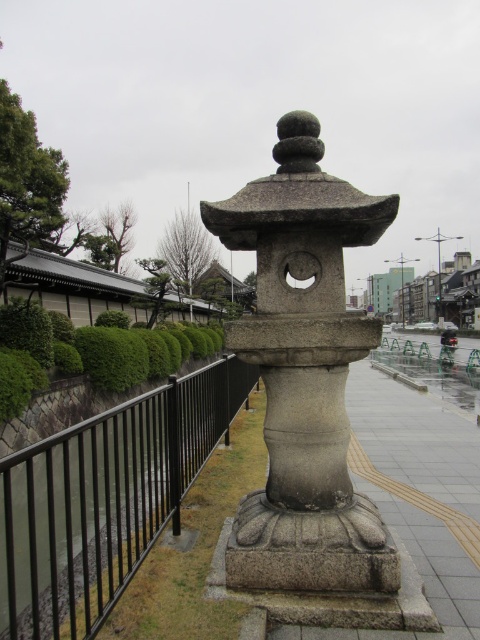
Question: Which of the following is the farthest from the observer?

Choices:
 (A) green bushy hedge at left
 (B) black metal fence at left
 (C) gray stone lantern at center

Answer: (A)

Question: Observing the image, what is the correct spatial positioning of gray stone lantern at center in reference to green bushy hedge at left?

Choices:
 (A) right
 (B) left

Answer: (A)

Question: Estimate the real-world distances between objects in this image. Which object is farther from the gray stone lantern at center?

Choices:
 (A) green bushy hedge at left
 (B) black metal fence at left

Answer: (A)

Question: Is gray stone lantern at center further to the viewer compared to black metal fence at left?

Choices:
 (A) yes
 (B) no

Answer: (A)

Question: From the image, what is the correct spatial relationship of gray stone lantern at center in relation to green bushy hedge at left?

Choices:
 (A) above
 (B) below

Answer: (A)

Question: Which object appears closest to the camera in this image?

Choices:
 (A) gray stone lantern at center
 (B) green bushy hedge at left
 (C) black metal fence at left

Answer: (C)